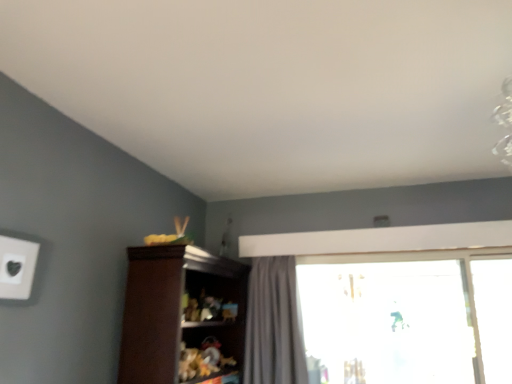
Question: Can you confirm if gray fabric curtain at center is shorter than white matte electric outlet at upper left?

Choices:
 (A) yes
 (B) no

Answer: (B)

Question: Can you confirm if gray fabric curtain at center is positioned to the left of white matte electric outlet at upper left?

Choices:
 (A) no
 (B) yes

Answer: (A)

Question: Is gray fabric curtain at center wider than white matte electric outlet at upper left?

Choices:
 (A) no
 (B) yes

Answer: (B)

Question: Is white matte electric outlet at upper left at the back of gray fabric curtain at center?

Choices:
 (A) no
 (B) yes

Answer: (A)

Question: Is gray fabric curtain at center not inside white matte electric outlet at upper left?

Choices:
 (A) no
 (B) yes

Answer: (B)

Question: Considering the relative sizes of gray fabric curtain at center and white matte electric outlet at upper left in the image provided, is gray fabric curtain at center bigger than white matte electric outlet at upper left?

Choices:
 (A) no
 (B) yes

Answer: (B)

Question: Does brown wood cupboard at center have a larger size compared to gray fabric curtain at center?

Choices:
 (A) yes
 (B) no

Answer: (A)

Question: Is brown wood cupboard at center not inside gray fabric curtain at center?

Choices:
 (A) yes
 (B) no

Answer: (A)

Question: From the image's perspective, does brown wood cupboard at center appear higher than gray fabric curtain at center?

Choices:
 (A) yes
 (B) no

Answer: (A)

Question: From a real-world perspective, is brown wood cupboard at center positioned over gray fabric curtain at center based on gravity?

Choices:
 (A) yes
 (B) no

Answer: (B)

Question: Is brown wood cupboard at center oriented away from gray fabric curtain at center?

Choices:
 (A) no
 (B) yes

Answer: (A)

Question: Does brown wood cupboard at center appear on the right side of gray fabric curtain at center?

Choices:
 (A) no
 (B) yes

Answer: (A)

Question: Does transparent glass window at center have a greater height compared to brown wood cupboard at center?

Choices:
 (A) no
 (B) yes

Answer: (B)